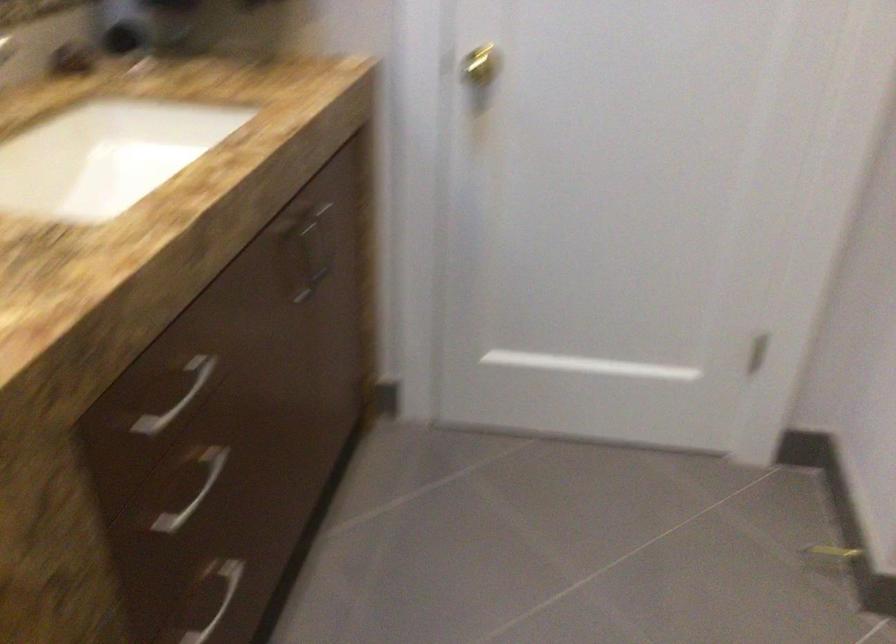
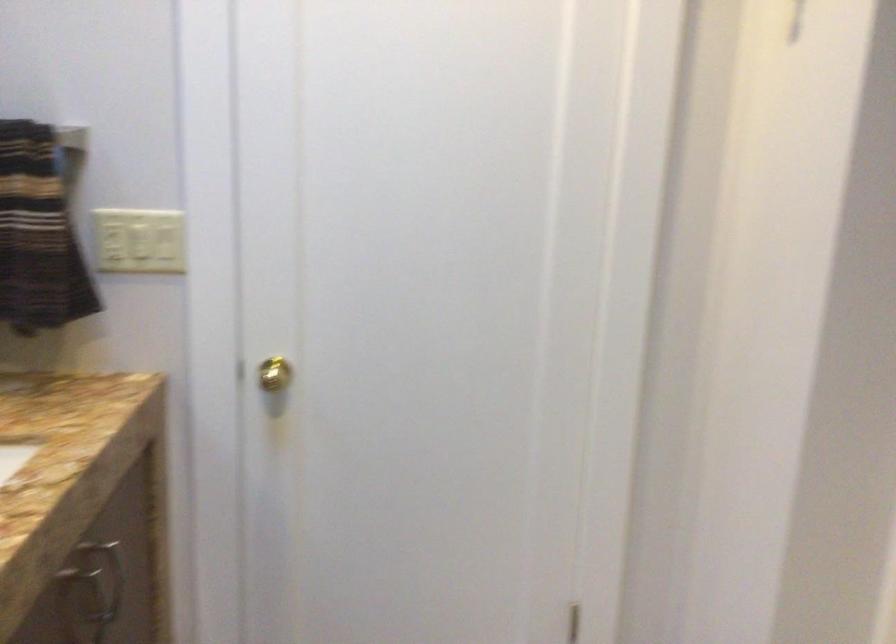
Question: The images are taken continuously from a first-person perspective. In which direction are you moving?

Choices:
 (A) Left
 (B) Right
 (C) Forward
 (D) Backward

Answer: (A)